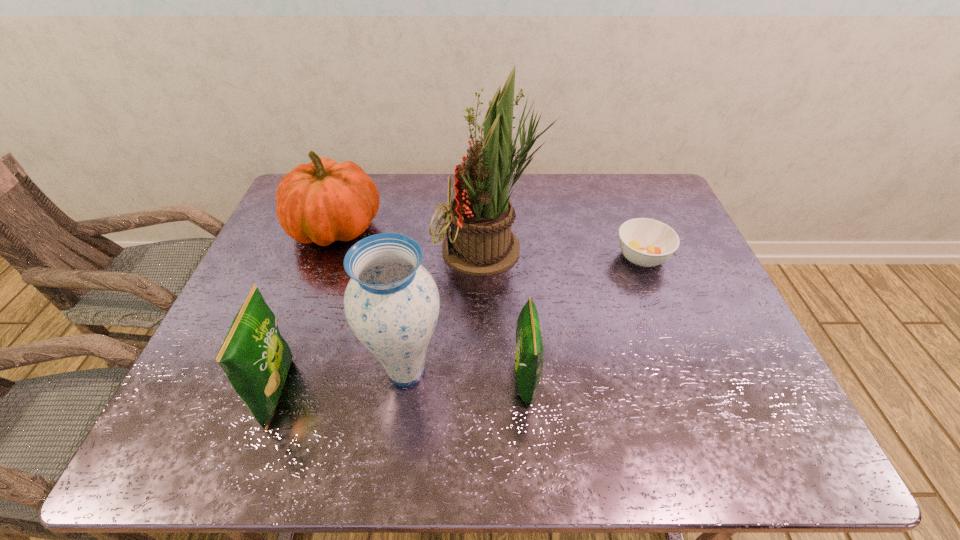
Find the location of a particular element. This screenshot has width=960, height=540. free space located 0.160m on the front of the pumpkin is located at coordinates (309, 303).

Identify the location of vacant area situated 0.090m on the right of the soup bowl. The height and width of the screenshot is (540, 960). (701, 257).

Find the location of a particular element. vacant space located in front of the flower arrangement with the fan visible is located at coordinates (398, 250).

The image size is (960, 540). In order to click on free region located 0.130m in front of the flower arrangement with the fan visible in this screenshot , I will do `click(392, 250)`.

Where is `vacant space located 0.250m in front of the flower arrangement with the fan visible`? Image resolution: width=960 pixels, height=540 pixels. vacant space located 0.250m in front of the flower arrangement with the fan visible is located at coordinates (350, 250).

Where is `free space located 0.160m on the left of the fifth shortest object`? The height and width of the screenshot is (540, 960). free space located 0.160m on the left of the fifth shortest object is located at coordinates (297, 370).

Locate an element on the screen. object positioned at the far edge is located at coordinates (323, 201).

Find the location of `vase situated at the near edge`. vase situated at the near edge is located at coordinates (391, 303).

What are the coordinates of `crisp (potato chip) present at the left edge` in the screenshot? It's located at (255, 358).

I want to click on pumpkin present at the left edge, so click(x=323, y=201).